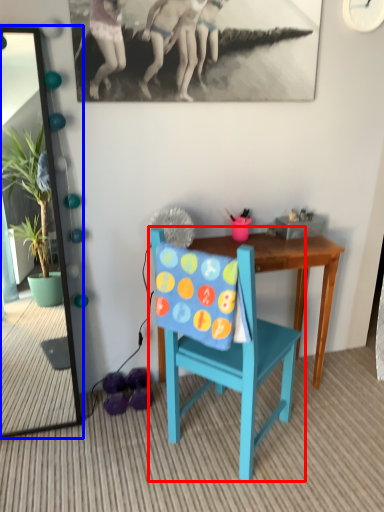
Question: Which point is closer to the camera, chair (highlighted by a red box) or mirror (highlighted by a blue box)?

Choices:
 (A) chair
 (B) mirror

Answer: (A)